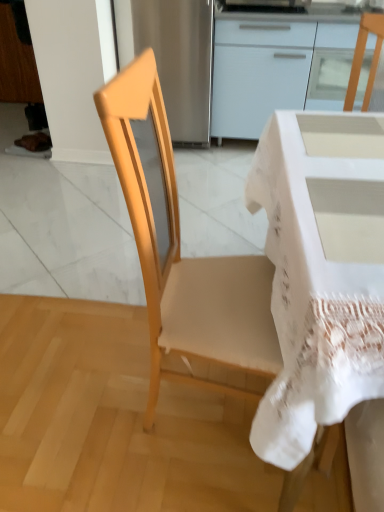
Question: Considering the relative sizes of white lace-covered desk at center and white glossy cabinet at upper center in the image provided, is white lace-covered desk at center smaller than white glossy cabinet at upper center?

Choices:
 (A) yes
 (B) no

Answer: (A)

Question: Can you confirm if white lace-covered desk at center is bigger than white glossy cabinet at upper center?

Choices:
 (A) no
 (B) yes

Answer: (A)

Question: Does white lace-covered desk at center have a lesser width compared to white glossy cabinet at upper center?

Choices:
 (A) yes
 (B) no

Answer: (B)

Question: Is white lace-covered desk at center facing towards white glossy cabinet at upper center?

Choices:
 (A) no
 (B) yes

Answer: (A)

Question: From a real-world perspective, is white lace-covered desk at center positioned under white glossy cabinet at upper center based on gravity?

Choices:
 (A) yes
 (B) no

Answer: (A)

Question: In the image, is white glossy cabinet at upper center positioned in front of or behind light wood chair at center?

Choices:
 (A) behind
 (B) front

Answer: (A)

Question: Considering the relative positions of white glossy cabinet at upper center and light wood chair at center in the image provided, is white glossy cabinet at upper center to the left or to the right of light wood chair at center?

Choices:
 (A) right
 (B) left

Answer: (A)

Question: Based on their sizes in the image, would you say white glossy cabinet at upper center is bigger or smaller than light wood chair at center?

Choices:
 (A) big
 (B) small

Answer: (A)

Question: In terms of width, does white glossy cabinet at upper center look wider or thinner when compared to light wood chair at center?

Choices:
 (A) wide
 (B) thin

Answer: (A)

Question: Considering the relative positions of light wood chair at center and white glossy cabinet at upper center in the image provided, is light wood chair at center to the left or to the right of white glossy cabinet at upper center?

Choices:
 (A) left
 (B) right

Answer: (A)

Question: From the image's perspective, is light wood chair at center positioned above or below white glossy cabinet at upper center?

Choices:
 (A) below
 (B) above

Answer: (A)

Question: From a real-world perspective, relative to white glossy cabinet at upper center, is light wood chair at center vertically above or below?

Choices:
 (A) below
 (B) above

Answer: (B)

Question: Is point (137, 118) closer or farther from the camera than point (347, 39)?

Choices:
 (A) closer
 (B) farther

Answer: (A)

Question: Is white glossy cabinet at upper center wider or thinner than white lace-covered desk at center?

Choices:
 (A) wide
 (B) thin

Answer: (B)

Question: From a real-world perspective, is white glossy cabinet at upper center positioned above or below white lace-covered desk at center?

Choices:
 (A) below
 (B) above

Answer: (B)